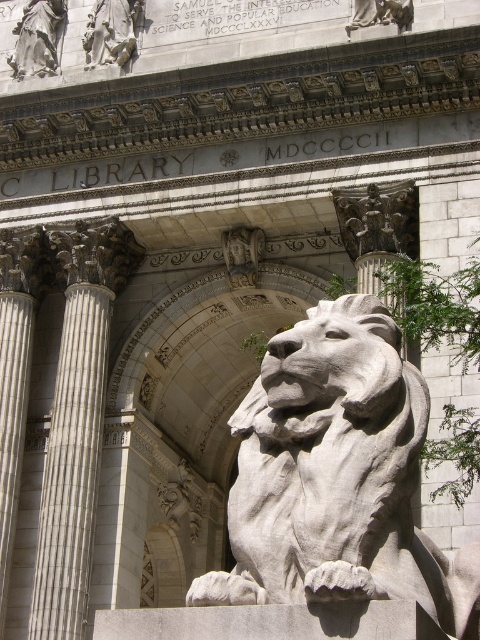
Question: Is white marble column at left wider than polished marble figures at upper left?

Choices:
 (A) no
 (B) yes

Answer: (B)

Question: Which object appears closest to the camera in this image?

Choices:
 (A) white marble statue at center
 (B) white stone lion at center

Answer: (B)

Question: Which point appears farthest from the camera in this image?

Choices:
 (A) (36, 586)
 (B) (177, 358)
 (C) (240, 268)
 (D) (124, 60)

Answer: (B)

Question: Which point appears closest to the camera in this image?

Choices:
 (A) (131, 38)
 (B) (64, 4)
 (C) (247, 236)

Answer: (C)

Question: Is white stone lion at center thinner than white marble column at left?

Choices:
 (A) yes
 (B) no

Answer: (B)

Question: Observing the image, what is the correct spatial positioning of white stone lion at center in reference to white marble column at left?

Choices:
 (A) right
 (B) left

Answer: (A)